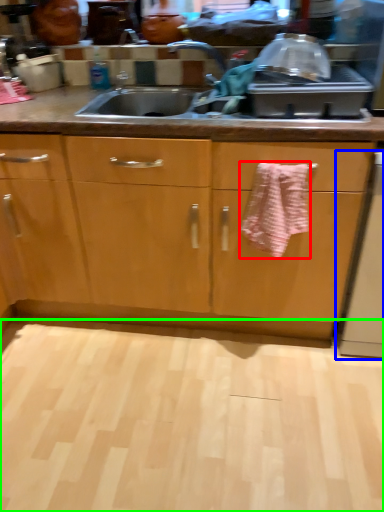
Question: Which object is positioned farthest from bath towel (highlighted by a red box)? Select from dish washer (highlighted by a blue box) and plain (highlighted by a green box).

Choices:
 (A) dish washer
 (B) plain

Answer: (B)